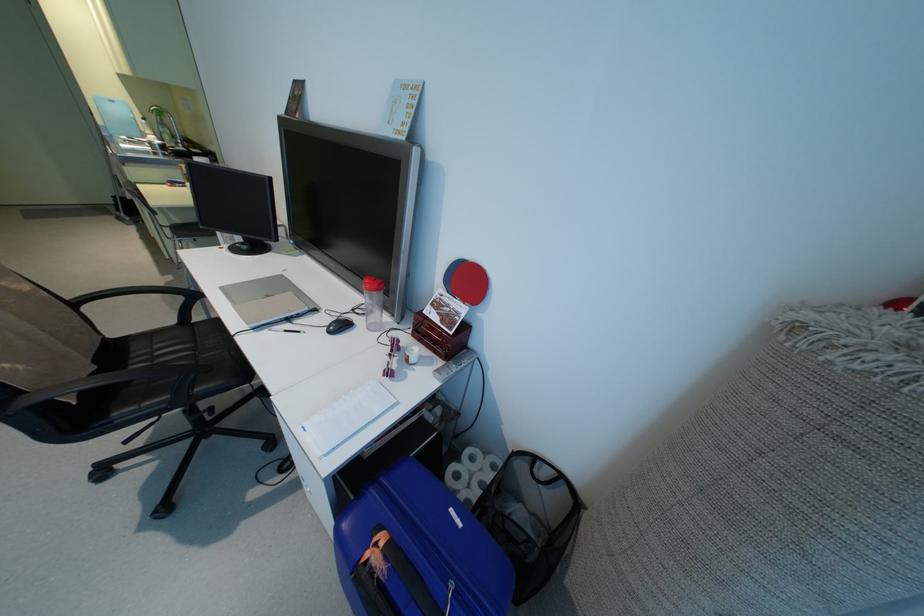
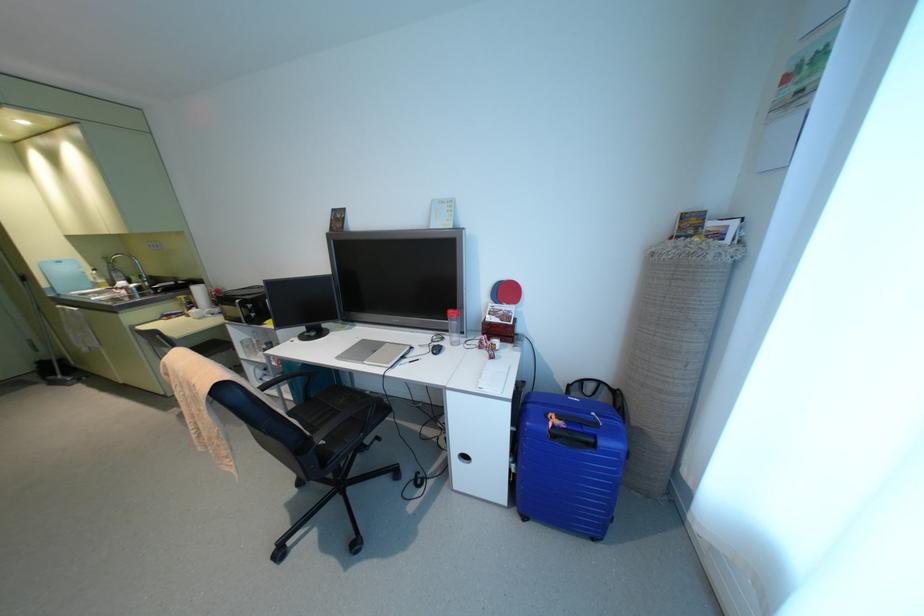
Find the pixel in the second image that matches [381,544] in the first image.

(553, 416)